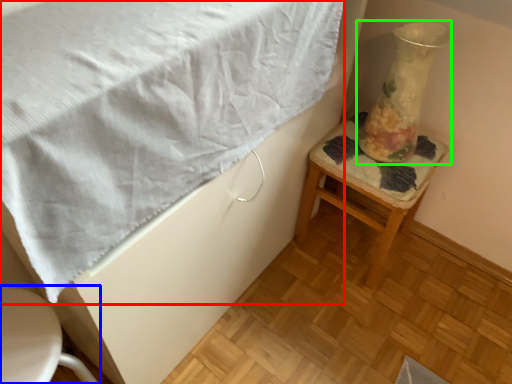
Question: Which object is positioned closest to blanket (highlighted by a red box)? Select from furniture (highlighted by a blue box) and vase (highlighted by a green box).

Choices:
 (A) furniture
 (B) vase

Answer: (A)